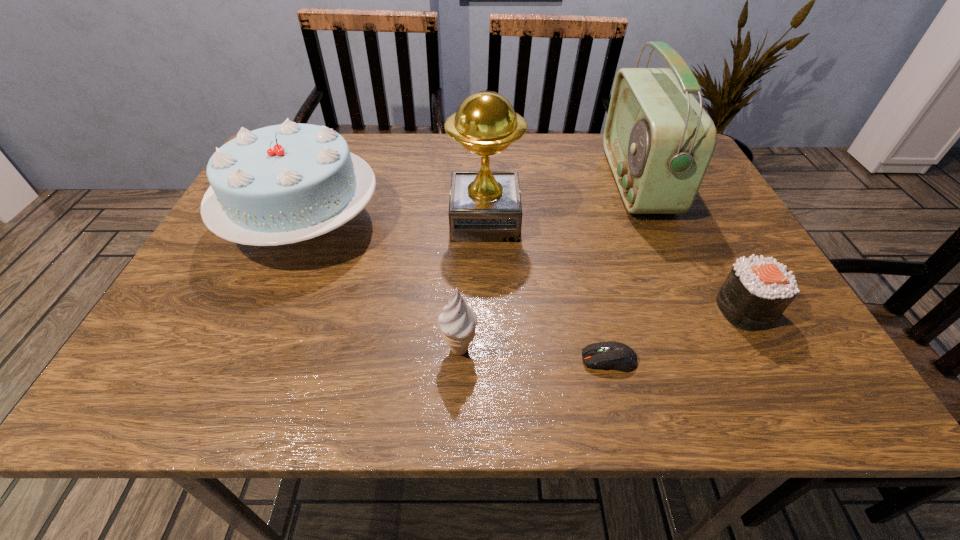
Where is `free space between the computer equipment and the fifth tallest object`? Image resolution: width=960 pixels, height=540 pixels. free space between the computer equipment and the fifth tallest object is located at coordinates (677, 334).

Locate an element on the screen. vacant area between the birthday cake and the fifth tallest object is located at coordinates (524, 266).

Locate an element on the screen. This screenshot has height=540, width=960. free space between the award and the icecream is located at coordinates (472, 285).

Select which object appears as the second closest to the leftmost object. Please provide its 2D coordinates. Your answer should be formatted as a tuple, i.e. [(x, y)], where the tuple contains the x and y coordinates of a point satisfying the conditions above.

[(458, 321)]

Locate an element on the screen. The height and width of the screenshot is (540, 960). object that can be found as the fifth closest to the computer equipment is located at coordinates (281, 184).

Where is `vacant point that satisfies the following two spatial constraints: 1. on the back side of the second shortest object; 2. on the front-facing side of the award`? The height and width of the screenshot is (540, 960). vacant point that satisfies the following two spatial constraints: 1. on the back side of the second shortest object; 2. on the front-facing side of the award is located at coordinates (697, 220).